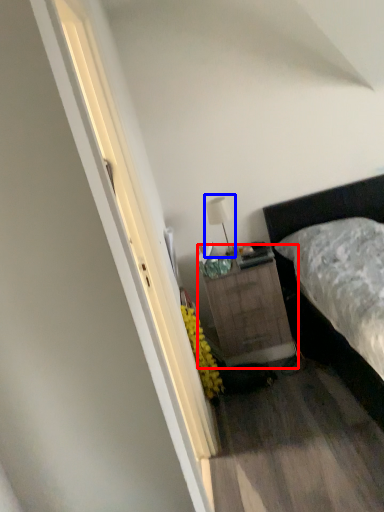
Question: Which of the following is the closest to the observer, nightstand (highlighted by a red box) or table lamp (highlighted by a blue box)?

Choices:
 (A) nightstand
 (B) table lamp

Answer: (A)